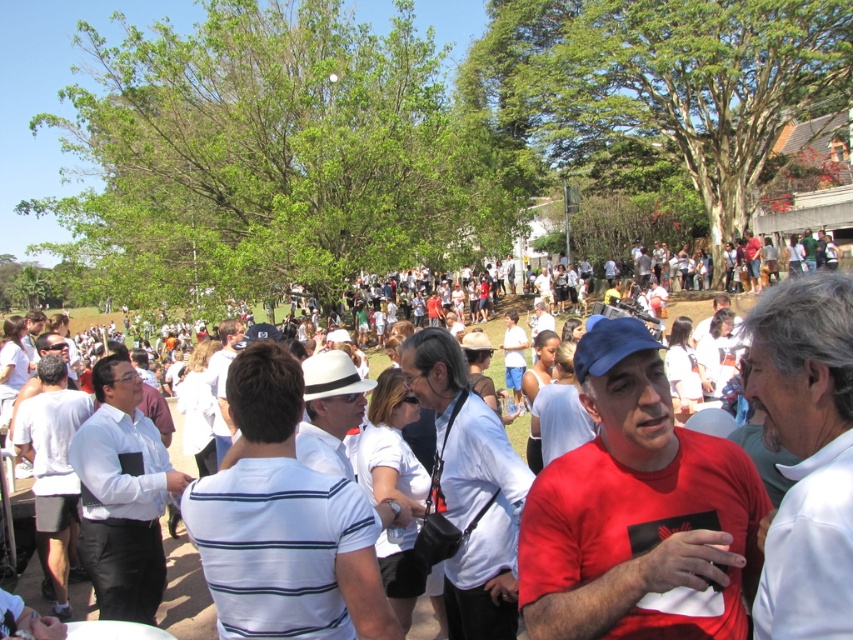
Who is shorter, matte red t-shirt at center or white smooth shirt at center?

matte red t-shirt at center

Is point (527, 512) farther from camera compared to point (786, 339)?

Yes, it is.

Who is more distant from viewer, (604, 552) or (770, 387)?

The point (604, 552) is behind.

This screenshot has width=853, height=640. What are the coordinates of `matte red t-shirt at center` in the screenshot? It's located at (637, 513).

Does point (621, 490) come in front of point (426, 401)?

Yes, point (621, 490) is in front of point (426, 401).

Who is positioned more to the right, matte red t-shirt at center or white matte shirt at center?

From the viewer's perspective, matte red t-shirt at center appears more on the right side.

Image resolution: width=853 pixels, height=640 pixels. I want to click on matte red t-shirt at center, so click(x=637, y=513).

Identify the location of matte red t-shirt at center. (637, 513).

Based on the photo, is white smooth shirt at center wider than white glossy shirt at center?

No, white smooth shirt at center is not wider than white glossy shirt at center.

Who is higher up, white smooth shirt at center or white glossy shirt at center?

white smooth shirt at center is above.

Is point (817, 481) less distant than point (120, 408)?

That is True.

What are the coordinates of `white smooth shirt at center` in the screenshot? It's located at (805, 454).